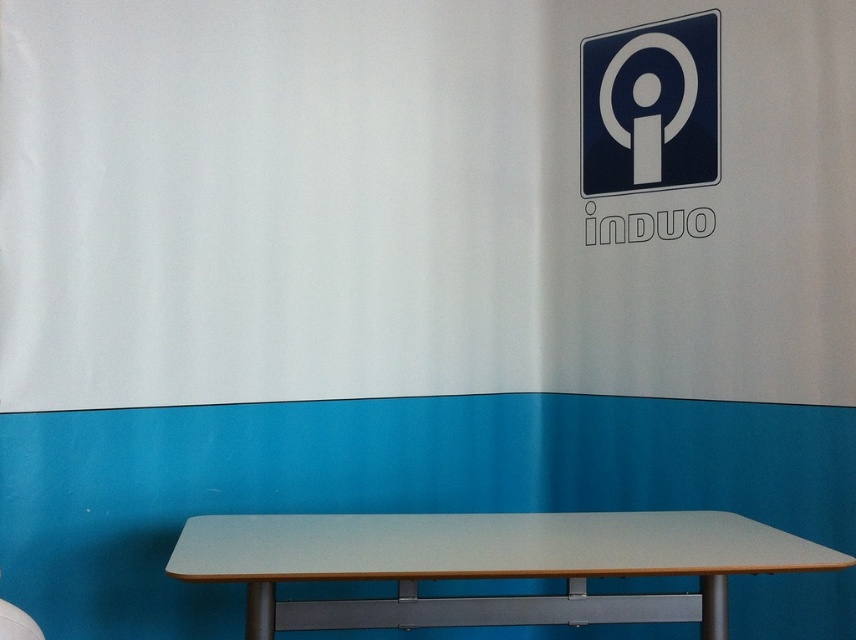
Question: Which point is closer to the camera taking this photo?

Choices:
 (A) (232, 570)
 (B) (626, 150)

Answer: (A)

Question: Does light gray laminate table at center appear over blue glossy sign at upper right?

Choices:
 (A) no
 (B) yes

Answer: (A)

Question: In this image, where is light gray laminate table at center located relative to blue glossy sign at upper right?

Choices:
 (A) left
 (B) right

Answer: (A)

Question: Can you confirm if light gray laminate table at center is smaller than blue glossy sign at upper right?

Choices:
 (A) yes
 (B) no

Answer: (B)

Question: Which of the following is the farthest from the observer?

Choices:
 (A) blue glossy sign at upper right
 (B) light gray laminate table at center

Answer: (A)

Question: Which object is closer to the camera taking this photo?

Choices:
 (A) light gray laminate table at center
 (B) blue glossy sign at upper right

Answer: (A)